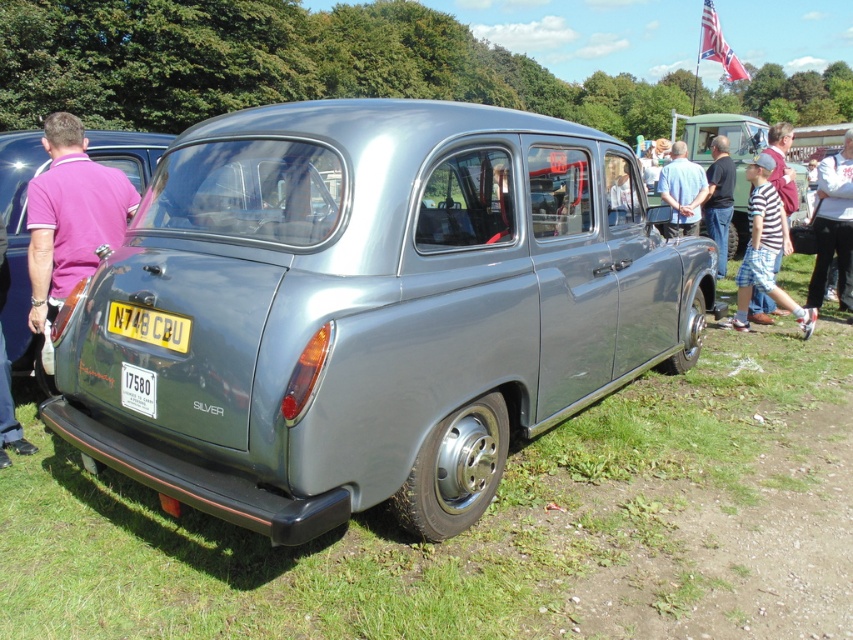
You are a photographer trying to capture a photo of the satin silver car at center and the striped fabric shirt at right. Based on their positions, which object is located lower in the image?

The satin silver car at center is located lower than the striped fabric shirt at right.

You are standing next to the vintage car and want to walk towards the white cotton jacket at upper right. Which direction should you move relative to the green grass at lower center?

You should move away from the green grass at lower center because the white cotton jacket at upper right is behind it.